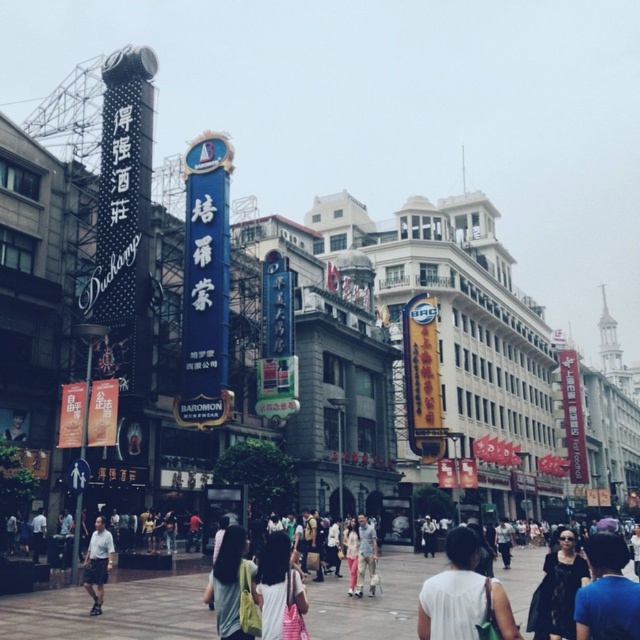
Is dark blue shirt at lower right to the left of light gray pants at center from the viewer's perspective?

Incorrect, dark blue shirt at lower right is not on the left side of light gray pants at center.

Where is `dark blue shirt at lower right`? Image resolution: width=640 pixels, height=640 pixels. dark blue shirt at lower right is located at coordinates 605,589.

Is point (584, 604) closer to camera compared to point (372, 550)?

Yes, point (584, 604) is closer to viewer.

Where is `dark blue shirt at lower right`? dark blue shirt at lower right is located at coordinates (605, 589).

Between white matte dress at center and light gray pants at center, which one is positioned higher?

white matte dress at center is higher up.

This screenshot has width=640, height=640. In order to click on white matte dress at center in this screenshot , I will do `click(461, 595)`.

Is dark blue shirt at lower right positioned before light blue shirt at center?

Yes, dark blue shirt at lower right is in front of light blue shirt at center.

Which is more to the left, dark blue shirt at lower right or light blue shirt at center?

Positioned to the left is light blue shirt at center.

You are a GUI agent. You are given a task and a screenshot of the screen. Output one action in this format:
    pyautogui.click(x=<x>, y=<y>)
    Task: Click on the dark blue shirt at lower right
    Image resolution: width=640 pixels, height=640 pixels.
    Given the screenshot: What is the action you would take?
    pyautogui.click(x=605, y=589)